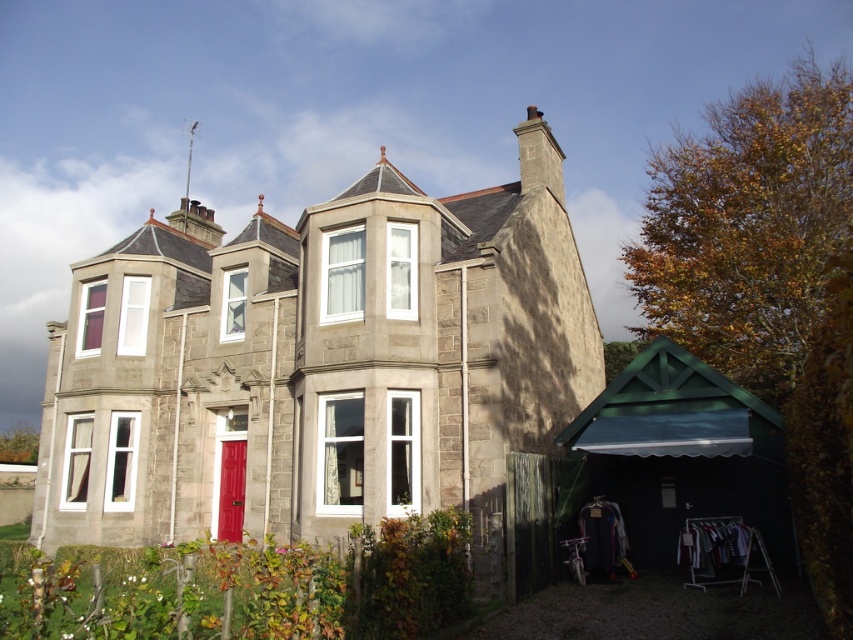
You are standing in front of the two story stone house. You see the smooth stone chimney at center and the smooth stone chimney at upper center. Which one is closer to the ground?

The smooth stone chimney at center is located below the smooth stone chimney at upper center, so it is closer to the ground.